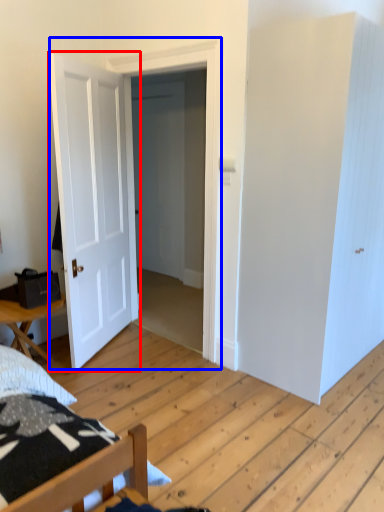
Question: Which point is closer to the camera, door (highlighted by a red box) or door (highlighted by a blue box)?

Choices:
 (A) door
 (B) door

Answer: (A)